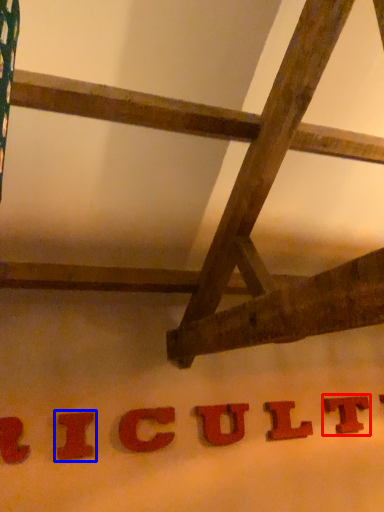
Question: Which of the following is the closest to the observer, letter (highlighted by a red box) or letter (highlighted by a blue box)?

Choices:
 (A) letter
 (B) letter

Answer: (B)